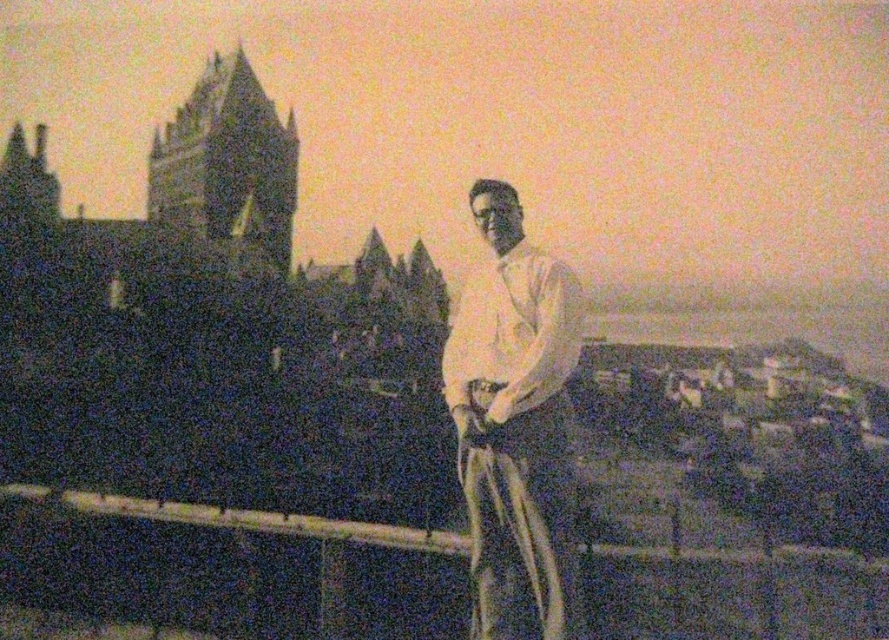
You are a photographer analyzing this vintage image. You notice the wooden rail at center and the white cotton shirt at center. Based on their positions, can you determine which object is located to the left?

The wooden rail at center is positioned on the left side of white cotton shirt at center, so the wooden rail at center is to the left.

You are a photographer analyzing this vintage image. You notice the wooden rail at center and the white cotton shirt at center. Based on the scene, which object is taller?

The white cotton shirt at center is taller than the wooden rail at center.